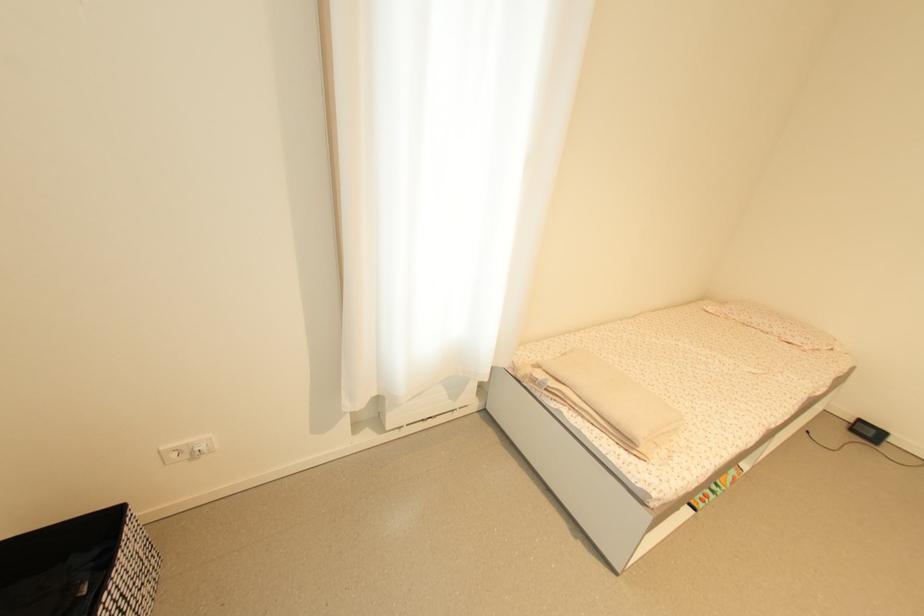
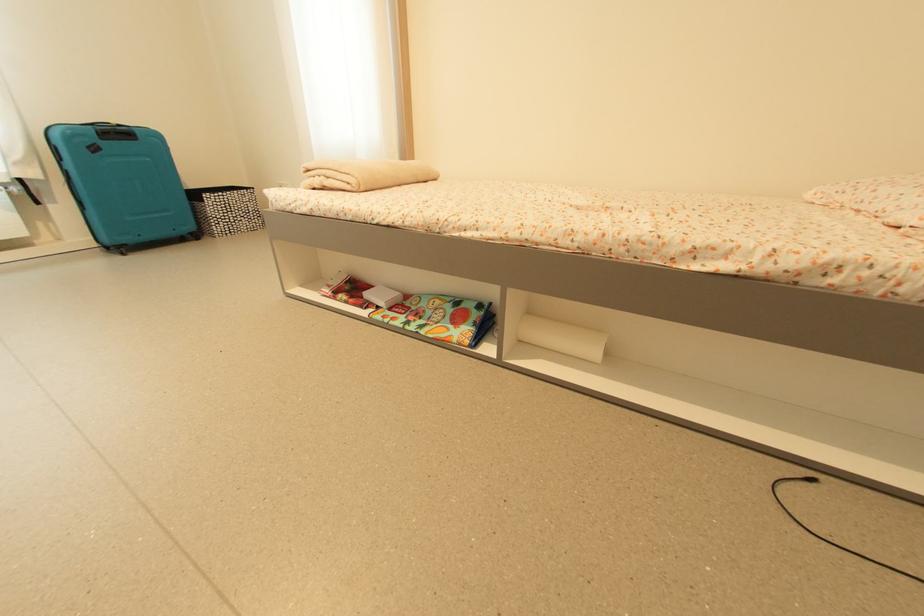
Where in the second image is the point corresponding to (x=812, y=434) from the first image?

(817, 483)